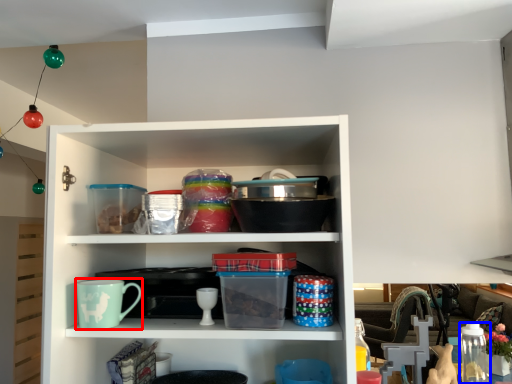
Question: Among these objects, which one is farthest to the camera, mug (highlighted by a red box) or glass jar (highlighted by a blue box)?

Choices:
 (A) mug
 (B) glass jar

Answer: (B)